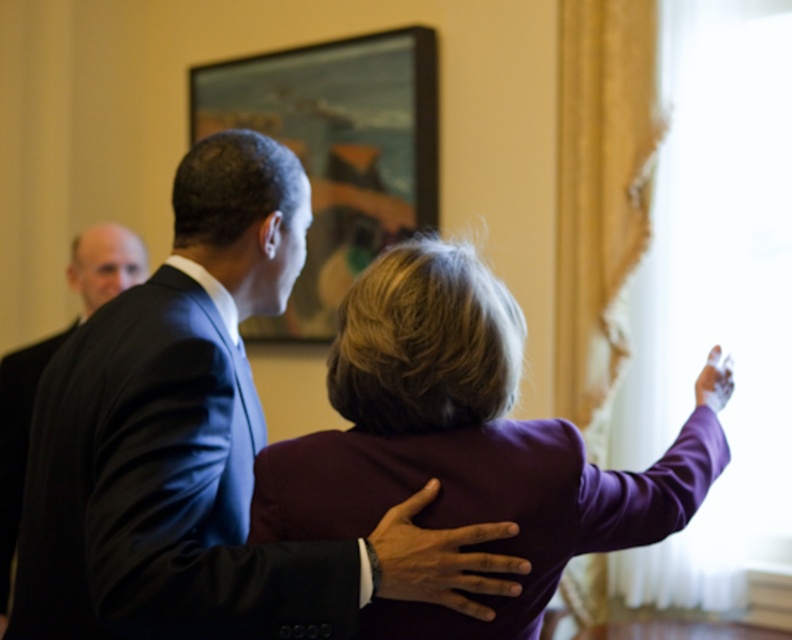
Can you confirm if dark blue smooth suit at center is thinner than black suit at left?

No.

Looking at this image, is dark blue smooth suit at center below black suit at left?

Correct, dark blue smooth suit at center is located below black suit at left.

Measure the distance between point (101, 548) and camera.

They are 1.21 meters apart.

The height and width of the screenshot is (640, 792). Identify the location of dark blue smooth suit at center. (160, 486).

Does wooden frame at upper center have a greater height compared to black suit at left?

No, wooden frame at upper center is not taller than black suit at left.

Between wooden frame at upper center and black suit at left, which one has less height?

wooden frame at upper center is shorter.

Is point (204, 115) more distant than point (17, 349)?

That is True.

This screenshot has width=792, height=640. In order to click on wooden frame at upper center in this screenshot , I will do `click(337, 150)`.

Looking at this image, who is positioned more to the right, purple fabric coat at upper center or black matte suit at left?

Positioned to the right is purple fabric coat at upper center.

Who is taller, purple fabric coat at upper center or black matte suit at left?

black matte suit at left is taller.

The height and width of the screenshot is (640, 792). What do you see at coordinates (461, 444) in the screenshot?
I see `purple fabric coat at upper center` at bounding box center [461, 444].

In order to click on purple fabric coat at upper center in this screenshot , I will do `click(461, 444)`.